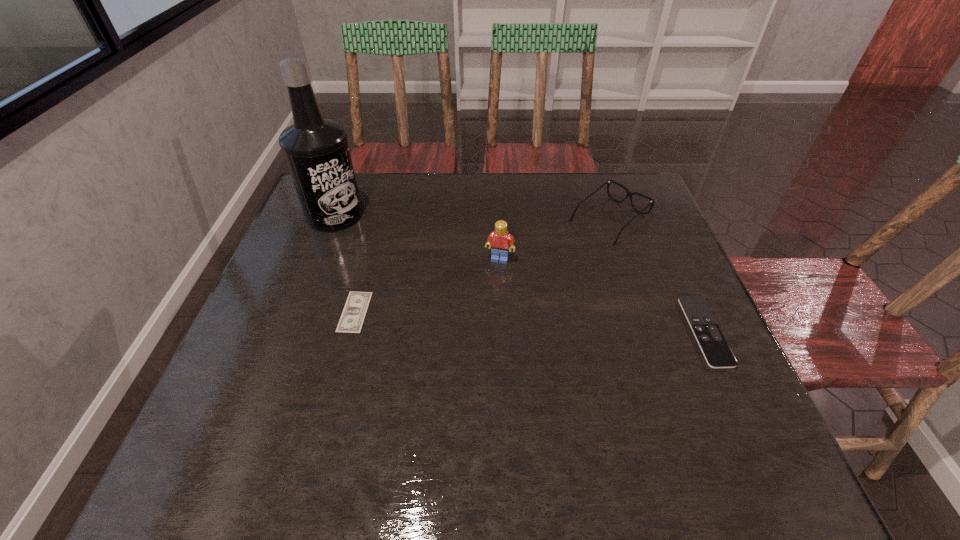
Image resolution: width=960 pixels, height=540 pixels. In order to click on free space at the near right corner in this screenshot , I will do `click(704, 399)`.

Where is `vacant space that's between the liquor and the fourth tallest object`? This screenshot has width=960, height=540. vacant space that's between the liquor and the fourth tallest object is located at coordinates (520, 273).

Identify the location of vacant space that is in between the money and the fourth tallest object. Image resolution: width=960 pixels, height=540 pixels. (530, 322).

You are a GUI agent. You are given a task and a screenshot of the screen. Output one action in this format:
    pyautogui.click(x=<x>, y=<y>)
    Task: Click on the vacant space that's between the money and the tallest object
    The image size is (960, 540).
    Given the screenshot: What is the action you would take?
    pyautogui.click(x=345, y=264)

Find the location of a particular element. free space between the fourth tallest object and the tallest object is located at coordinates (520, 273).

Locate an element on the screen. vacant space in between the third shortest object and the second shortest object is located at coordinates (658, 275).

Locate an element on the screen. free space that is in between the liquor and the third shortest object is located at coordinates [x=472, y=217].

I want to click on free space between the third object from left to right and the third tallest object, so click(555, 239).

Locate an element on the screen. free spot between the remote control and the third shortest object is located at coordinates (658, 275).

Identify the location of free space between the Lego and the liquor. (418, 237).